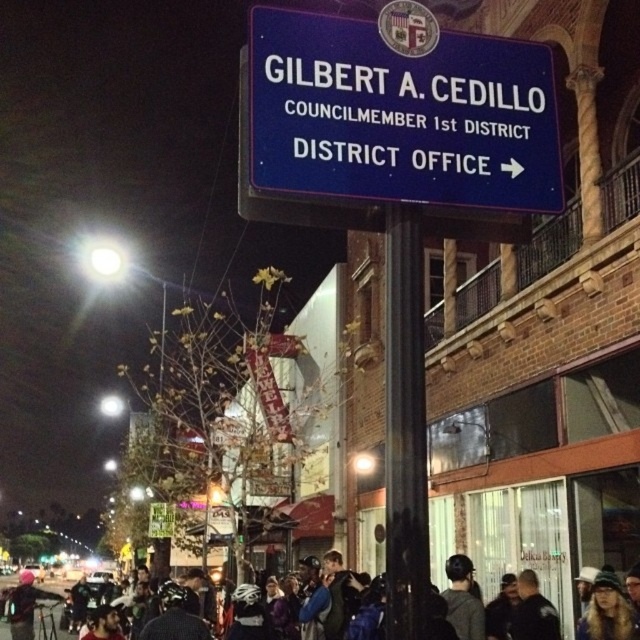
Between blue metallic sign at upper center and pink fabric helmet at lower left, which one appears on the left side from the viewer's perspective?

pink fabric helmet at lower left is more to the left.

Does blue metallic sign at upper center appear on the left side of pink fabric helmet at lower left?

Incorrect, blue metallic sign at upper center is not on the left side of pink fabric helmet at lower left.

Is point (548, 134) farther from camera compared to point (16, 609)?

No, it is not.

Find the location of `blue metallic sign at upper center`. blue metallic sign at upper center is located at coordinates (394, 124).

Does black glossy pole at center have a greater height compared to dark blue jacket at lower center?

No.

Which is more to the right, black glossy pole at center or dark blue jacket at lower center?

Positioned to the right is black glossy pole at center.

At what (x,y) coordinates should I click in order to perform the action: click on black glossy pole at center. Please return your answer as a coordinate pair (x, y). This screenshot has width=640, height=640. Looking at the image, I should click on (404, 428).

Find the location of a particular element. black glossy pole at center is located at coordinates (404, 428).

Can you confirm if blue metallic sign at upper center is taller than black glossy pole at center?

No.

Between blue metallic sign at upper center and black glossy pole at center, which one is positioned lower?

black glossy pole at center is lower down.

Locate an element on the screen. The image size is (640, 640). blue metallic sign at upper center is located at coordinates (394, 124).

Identify the location of blue metallic sign at upper center. The width and height of the screenshot is (640, 640). (394, 124).